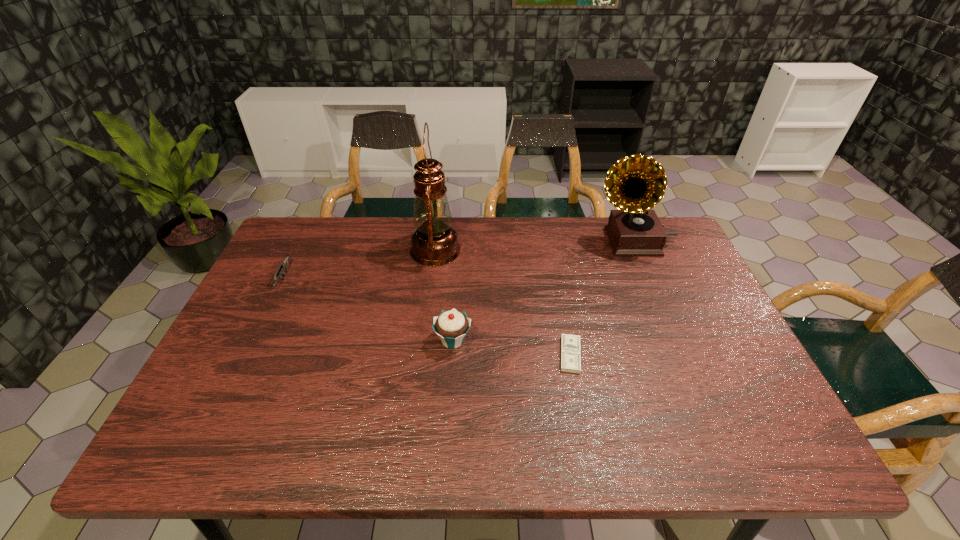
The width and height of the screenshot is (960, 540). Identify the location of free spot between the fourth tallest object and the fourth object from left to right. (427, 317).

At what (x,y) coordinates should I click in order to perform the action: click on vacant area that lies between the rightmost object and the cupcake. Please return your answer as a coordinate pair (x, y). This screenshot has height=540, width=960. Looking at the image, I should click on (542, 291).

The height and width of the screenshot is (540, 960). Find the location of `free spot between the phonograph record and the gun`. free spot between the phonograph record and the gun is located at coordinates (458, 260).

You are a GUI agent. You are given a task and a screenshot of the screen. Output one action in this format:
    pyautogui.click(x=<x>, y=<y>)
    Task: Click on the free spot between the third shortest object and the shortest object
    This screenshot has height=540, width=960.
    Given the screenshot: What is the action you would take?
    pyautogui.click(x=512, y=348)

Where is `unoccupied area between the shortest object and the cupcake`? unoccupied area between the shortest object and the cupcake is located at coordinates (512, 348).

At what (x,y) coordinates should I click in order to perform the action: click on empty location between the shortest object and the third tallest object. Please return your answer as a coordinate pair (x, y). Image resolution: width=960 pixels, height=540 pixels. Looking at the image, I should click on pos(512,348).

Locate an element on the screen. This screenshot has width=960, height=540. unoccupied area between the oil lamp and the money is located at coordinates (503, 302).

In order to click on the fourth closest object to the second object from right to left in this screenshot , I will do `click(284, 265)`.

Where is `the second closest object to the rightmost object`? This screenshot has height=540, width=960. the second closest object to the rightmost object is located at coordinates (434, 242).

This screenshot has height=540, width=960. What are the coordinates of `vacant space that satisfies the following two spatial constraints: 1. from the horn of the phonograph record; 2. aimed along the barrel of the fourth tallest object` in the screenshot? It's located at (649, 279).